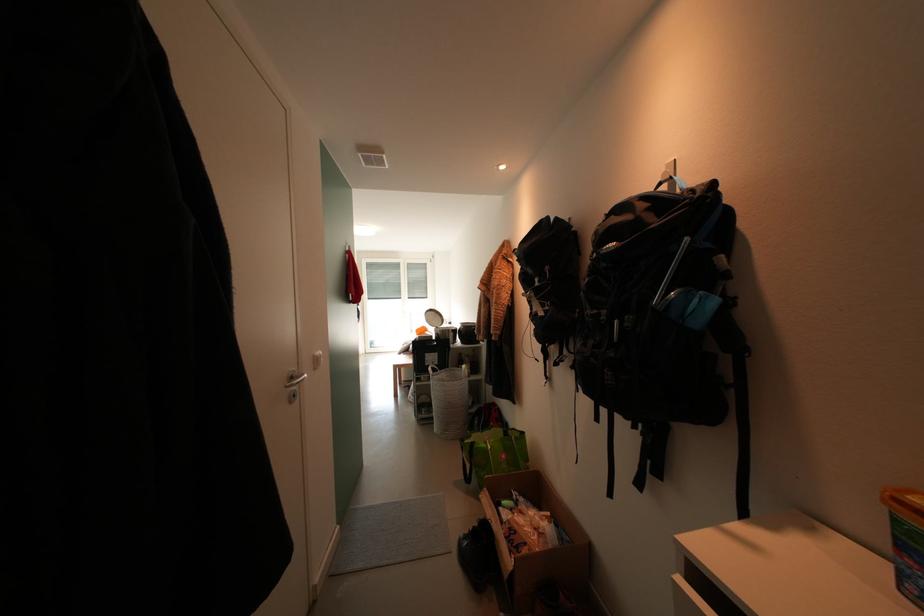
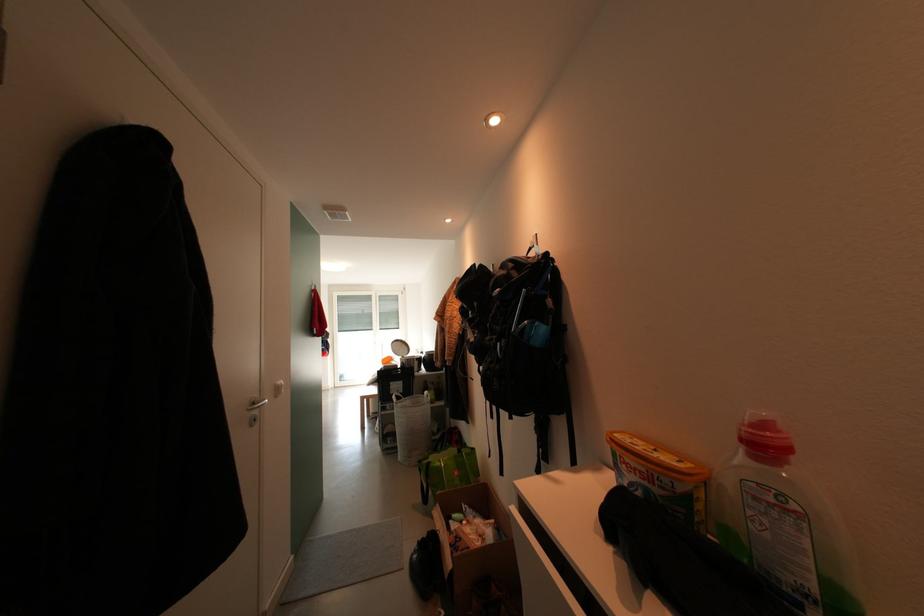
The point at (x=299, y=381) is marked in the first image. Where is the corresponding point in the second image?

(261, 407)